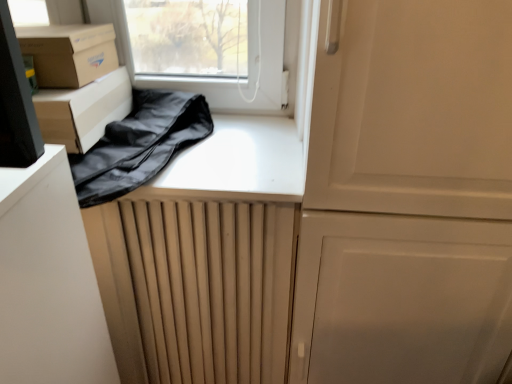
Question: Is the position of brown cardboard box at upper left, the 2th cardboard box from the bottom, less distant than that of matte cardboard box at left, the 2th cardboard box when ordered from top to bottom?

Choices:
 (A) no
 (B) yes

Answer: (A)

Question: Is brown cardboard box at upper left, the first cardboard box in the top-to-bottom sequence, positioned far away from matte cardboard box at left, which is counted as the 1th cardboard box, starting from the bottom?

Choices:
 (A) yes
 (B) no

Answer: (B)

Question: Can you confirm if brown cardboard box at upper left, the 2th cardboard box from the bottom, is taller than matte cardboard box at left, the 2th cardboard box when ordered from top to bottom?

Choices:
 (A) no
 (B) yes

Answer: (A)

Question: From a real-world perspective, is brown cardboard box at upper left, the 2th cardboard box from the bottom, positioned over matte cardboard box at left, which is counted as the 1th cardboard box, starting from the bottom, based on gravity?

Choices:
 (A) no
 (B) yes

Answer: (B)

Question: Is brown cardboard box at upper left, the first cardboard box in the top-to-bottom sequence, surrounding matte cardboard box at left, the 2th cardboard box when ordered from top to bottom?

Choices:
 (A) yes
 (B) no

Answer: (B)

Question: Do you think brown cardboard box at upper left, the 2th cardboard box from the bottom, is within matte cardboard box at left, which is counted as the 1th cardboard box, starting from the bottom, or outside of it?

Choices:
 (A) inside
 (B) outside

Answer: (B)

Question: Is point (100, 76) closer or farther from the camera than point (93, 119)?

Choices:
 (A) farther
 (B) closer

Answer: (A)

Question: From the image's perspective, is brown cardboard box at upper left, the first cardboard box in the top-to-bottom sequence, positioned above or below matte cardboard box at left, which is counted as the 1th cardboard box, starting from the bottom?

Choices:
 (A) above
 (B) below

Answer: (A)

Question: Looking at their shapes, would you say brown cardboard box at upper left, the 2th cardboard box from the bottom, is wider or thinner than matte cardboard box at left, which is counted as the 1th cardboard box, starting from the bottom?

Choices:
 (A) wide
 (B) thin

Answer: (B)

Question: Looking at the image, does matte cardboard box at left, which is counted as the 1th cardboard box, starting from the bottom, seem bigger or smaller compared to black fabric bag at upper left?

Choices:
 (A) big
 (B) small

Answer: (B)

Question: In the image, is matte cardboard box at left, the 2th cardboard box when ordered from top to bottom, positioned in front of or behind black fabric bag at upper left?

Choices:
 (A) front
 (B) behind

Answer: (B)

Question: Is matte cardboard box at left, which is counted as the 1th cardboard box, starting from the bottom, taller or shorter than black fabric bag at upper left?

Choices:
 (A) tall
 (B) short

Answer: (A)

Question: From a real-world perspective, relative to black fabric bag at upper left, is matte cardboard box at left, which is counted as the 1th cardboard box, starting from the bottom, vertically above or below?

Choices:
 (A) above
 (B) below

Answer: (A)

Question: Considering the relative positions of black fabric bag at upper left and brown cardboard box at upper left, the first cardboard box in the top-to-bottom sequence, in the image provided, is black fabric bag at upper left to the left or to the right of brown cardboard box at upper left, the first cardboard box in the top-to-bottom sequence,?

Choices:
 (A) left
 (B) right

Answer: (B)

Question: Considering the positions of point (184, 137) and point (74, 74), is point (184, 137) closer or farther from the camera than point (74, 74)?

Choices:
 (A) closer
 (B) farther

Answer: (B)